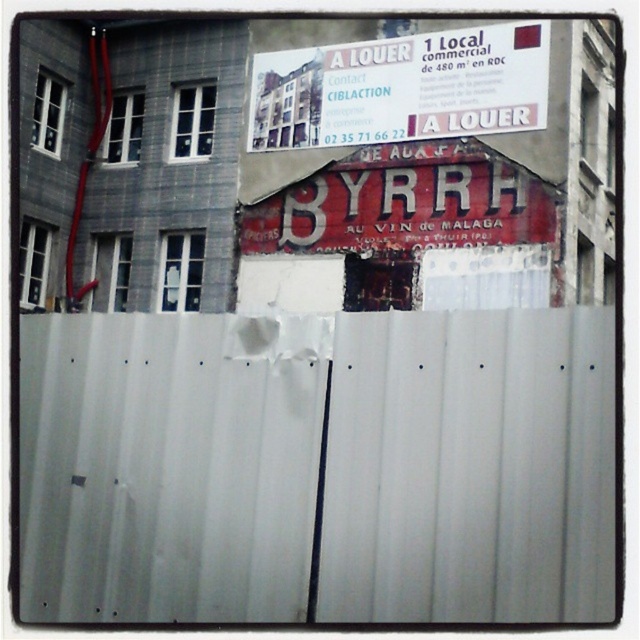
Does white corrugated metal fence at center have a lesser width compared to white paper sign at upper center?

No, white corrugated metal fence at center is not thinner than white paper sign at upper center.

Who is more distant from viewer, (588, 314) or (387, 90)?

The point (387, 90) is more distant.

Locate an element on the screen. white corrugated metal fence at center is located at coordinates (317, 468).

In the scene shown: Which is below, white paper sign at upper center or red painted wooden signboard at center?

red painted wooden signboard at center is below.

From the picture: Is white paper sign at upper center taller than red painted wooden signboard at center?

No, white paper sign at upper center is not taller than red painted wooden signboard at center.

Is point (320, 109) less distant than point (241, 236)?

Yes, it is.

The width and height of the screenshot is (640, 640). I want to click on white paper sign at upper center, so click(401, 88).

Is point (540, 595) farther from viewer compared to point (269, 204)?

That is False.

Is point (545, 536) closer to viewer compared to point (326, 224)?

Yes, point (545, 536) is closer to viewer.

Identify the location of white corrugated metal fence at center. This screenshot has width=640, height=640. (317, 468).